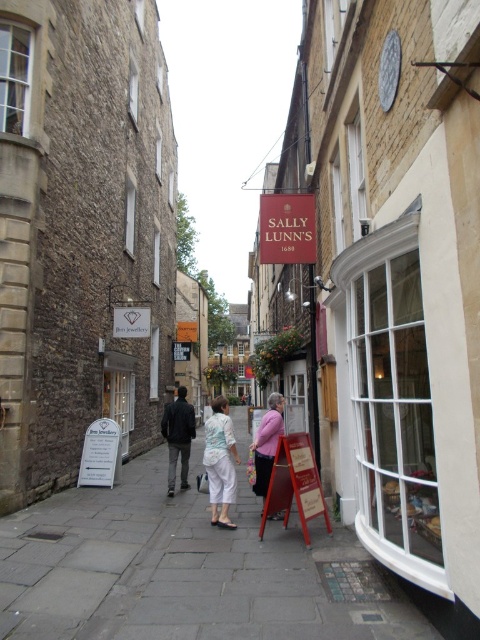
Question: Which point is farther from the camera taking this photo?

Choices:
 (A) (266, 417)
 (B) (212, 465)

Answer: (A)

Question: In this image, where is gray stone pavement at center located relative to light blue fabric blouse at center?

Choices:
 (A) below
 (B) above

Answer: (A)

Question: Which object is farther from the camera taking this photo?

Choices:
 (A) gray stone pavement at center
 (B) pink fabric at center
 (C) white cotton pants at center
 (D) light blue fabric blouse at center

Answer: (B)

Question: Which object is farther from the camera taking this photo?

Choices:
 (A) white cotton pants at center
 (B) light blue fabric blouse at center
 (C) gray stone pavement at center
 (D) pink fabric at center

Answer: (D)

Question: Does gray stone pavement at center have a larger size compared to pink fabric at center?

Choices:
 (A) no
 (B) yes

Answer: (B)

Question: Is white cotton pants at center above light blue fabric blouse at center?

Choices:
 (A) no
 (B) yes

Answer: (B)